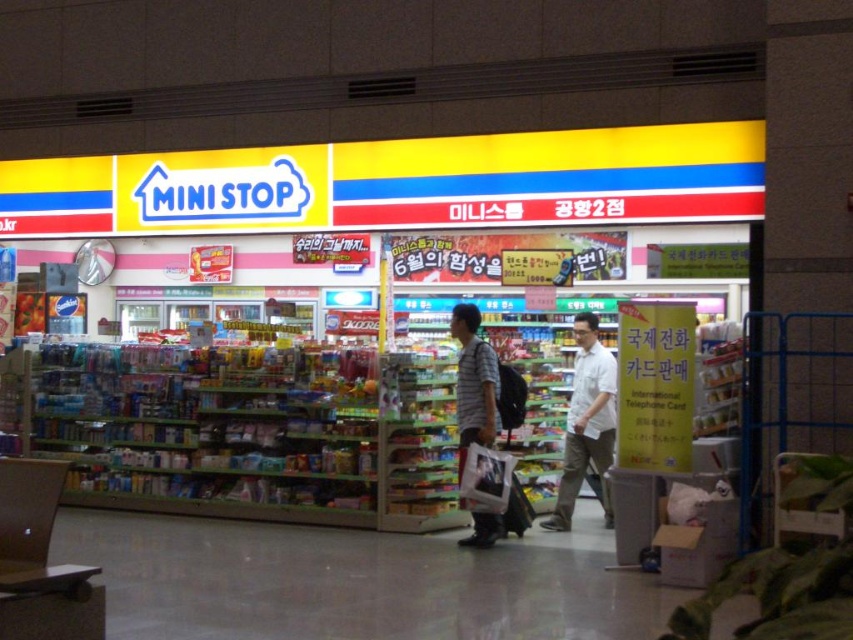
Is white cotton shirt at center shorter than striped cotton shirt at center?

In fact, white cotton shirt at center may be taller than striped cotton shirt at center.

Is white cotton shirt at center thinner than striped cotton shirt at center?

In fact, white cotton shirt at center might be wider than striped cotton shirt at center.

This screenshot has width=853, height=640. What do you see at coordinates (585, 422) in the screenshot? I see `white cotton shirt at center` at bounding box center [585, 422].

Where is `white cotton shirt at center`? The height and width of the screenshot is (640, 853). white cotton shirt at center is located at coordinates (585, 422).

Can you confirm if yellow matte sign at upper center is positioned to the left of striped cotton shirt at center?

Correct, you'll find yellow matte sign at upper center to the left of striped cotton shirt at center.

Is yellow matte sign at upper center above striped cotton shirt at center?

Yes, yellow matte sign at upper center is above striped cotton shirt at center.

Is point (178, 179) behind point (488, 428)?

Yes, point (178, 179) is behind point (488, 428).

I want to click on yellow matte sign at upper center, so click(x=399, y=182).

Measure the distance between yellow matte sign at upper center and camera.

A distance of 8.10 meters exists between yellow matte sign at upper center and camera.

Who is shorter, yellow matte sign at upper center or white cotton shirt at center?

yellow matte sign at upper center

Does point (225, 195) come closer to viewer compared to point (566, 522)?

No, (225, 195) is further to viewer.

The height and width of the screenshot is (640, 853). In order to click on yellow matte sign at upper center in this screenshot , I will do `click(399, 182)`.